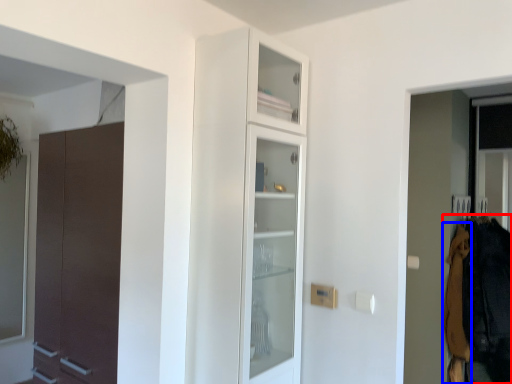
Question: Which object appears farthest to the camera in this image, clothing (highlighted by a red box) or clothing (highlighted by a blue box)?

Choices:
 (A) clothing
 (B) clothing

Answer: (B)